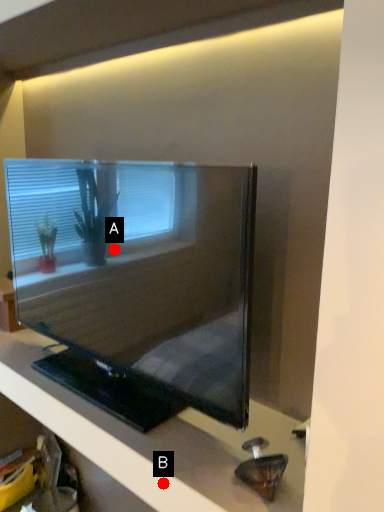
Question: Two points are circled on the image, labeled by A and B beside each circle. Which point is closer to the camera?

Choices:
 (A) A is closer
 (B) B is closer

Answer: (B)